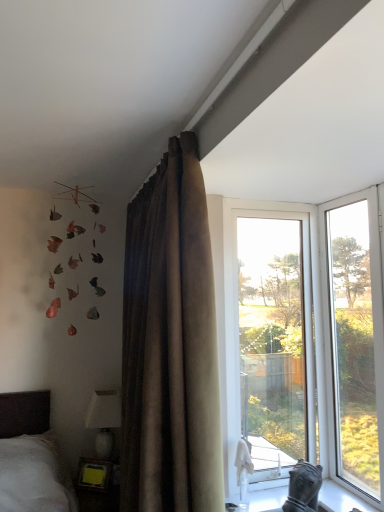
Question: In terms of height, does white glossy stone at lower right look taller or shorter compared to wooden frame at lower left?

Choices:
 (A) tall
 (B) short

Answer: (B)

Question: Is white glossy stone at lower right inside the boundaries of wooden frame at lower left, or outside?

Choices:
 (A) inside
 (B) outside

Answer: (B)

Question: Which of these objects is positioned closest to the white glossy lampshade at lower left?

Choices:
 (A) wooden frame at lower left
 (B) white glossy stone at lower right
 (C) brown velvet curtain at upper center
 (D) transparent glass window at center, which ranks as the first window in left-to-right order
 (E) transparent glass window at right, the 2th window in the left-to-right sequence

Answer: (A)

Question: Which object is the closest to the white glossy stone at lower right?

Choices:
 (A) transparent glass window at center, which is counted as the second window, starting from the right
 (B) brown velvet curtain at upper center
 (C) transparent glass window at right, arranged as the first window when viewed from the right
 (D) white glossy lampshade at lower left
 (E) wooden frame at lower left

Answer: (A)